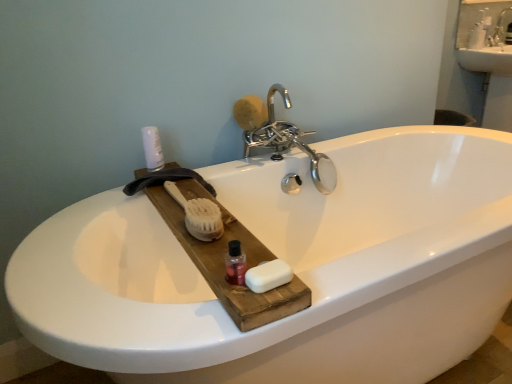
Question: Should I look upward or downward to see yellow sponge at upper center, marked as the second soap in a bottom-to-top arrangement?

Choices:
 (A) up
 (B) down

Answer: (A)

Question: Can you confirm if translucent plastic bottle at center is wider than white matte soap at center, positioned as the first soap in front-to-back order?

Choices:
 (A) yes
 (B) no

Answer: (B)

Question: Is translucent plastic bottle at center at the left side of white matte soap at center, the second soap from the back?

Choices:
 (A) yes
 (B) no

Answer: (A)

Question: Is translucent plastic bottle at center not within white matte soap at center, which is counted as the first soap, starting from the bottom?

Choices:
 (A) yes
 (B) no

Answer: (A)

Question: Can white matte soap at center, which is counted as the first soap, starting from the bottom, be found inside translucent plastic bottle at center?

Choices:
 (A) no
 (B) yes

Answer: (A)

Question: Is translucent plastic bottle at center oriented away from white matte soap at center, positioned as the first soap in front-to-back order?

Choices:
 (A) yes
 (B) no

Answer: (B)

Question: Is translucent plastic bottle at center bigger than white matte soap at center, the second soap when ordered from top to bottom?

Choices:
 (A) yes
 (B) no

Answer: (B)

Question: Would you say white matte spray can at upper left is part of white natural wood brush at center's contents?

Choices:
 (A) no
 (B) yes

Answer: (A)

Question: Can you confirm if white natural wood brush at center is positioned to the right of white matte spray can at upper left?

Choices:
 (A) no
 (B) yes

Answer: (B)

Question: Is white natural wood brush at center bigger than white matte spray can at upper left?

Choices:
 (A) yes
 (B) no

Answer: (A)

Question: Is white natural wood brush at center thinner than white matte spray can at upper left?

Choices:
 (A) yes
 (B) no

Answer: (B)

Question: From the image's perspective, is white natural wood brush at center under white matte spray can at upper left?

Choices:
 (A) yes
 (B) no

Answer: (A)

Question: Can you confirm if white natural wood brush at center is taller than white matte spray can at upper left?

Choices:
 (A) yes
 (B) no

Answer: (B)

Question: Does chrome metallic faucet at upper center contain white matte spray can at upper left?

Choices:
 (A) yes
 (B) no

Answer: (B)